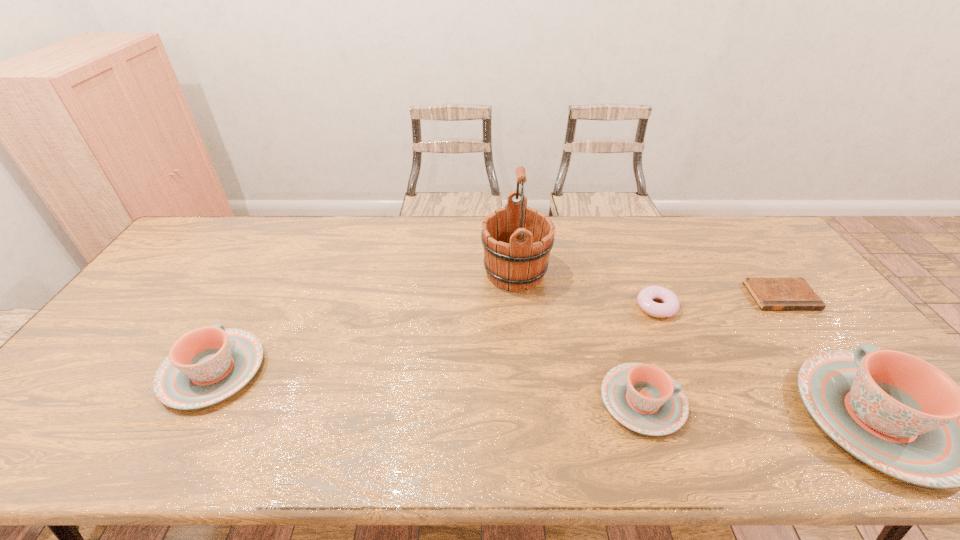
Find the location of a particular element. The height and width of the screenshot is (540, 960). vacant area at the right edge is located at coordinates (779, 261).

Locate an element on the screen. Image resolution: width=960 pixels, height=540 pixels. vacant space at the far left corner of the desktop is located at coordinates (226, 231).

I want to click on free point between the doughnut and the shortest object, so pos(718,301).

Image resolution: width=960 pixels, height=540 pixels. In order to click on free space between the fifth object from right to left and the second shortest object in this screenshot , I will do `click(586, 289)`.

In order to click on blank region between the second object from left to right and the second tallest chinaware in this screenshot , I will do `click(364, 322)`.

Find the location of `unoccupied area between the doughnut and the fourth shortest object`. unoccupied area between the doughnut and the fourth shortest object is located at coordinates (435, 339).

You are a GUI agent. You are given a task and a screenshot of the screen. Output one action in this format:
    pyautogui.click(x=<x>, y=<y>)
    Task: Click on the free space between the second tallest chinaware and the tallest object
    The width and height of the screenshot is (960, 540).
    Given the screenshot: What is the action you would take?
    (x=364, y=322)

Where is `empty space between the wine bucket and the fourth shortest object`? The height and width of the screenshot is (540, 960). empty space between the wine bucket and the fourth shortest object is located at coordinates (364, 322).

Identify the location of vacant point located between the leftmost chinaware and the second shortest object. This screenshot has width=960, height=540. (435, 339).

At what (x,y) coordinates should I click in order to perform the action: click on blank region between the diary and the shortest chinaware. Please return your answer as a coordinate pair (x, y). The image size is (960, 540). Looking at the image, I should click on (711, 348).